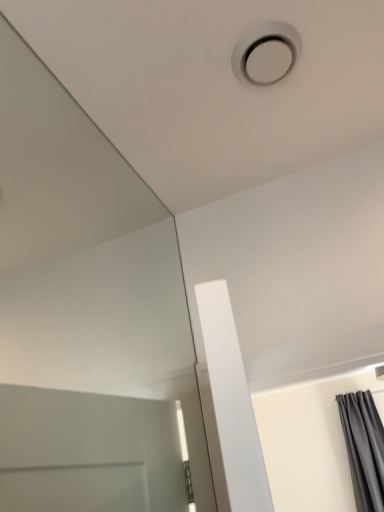
Where is `gray matte curtain at lower right`? The image size is (384, 512). gray matte curtain at lower right is located at coordinates (364, 448).

What do you see at coordinates (364, 448) in the screenshot? I see `gray matte curtain at lower right` at bounding box center [364, 448].

In order to face gray matte curtain at lower right, should I rotate leftwards or rightwards?

Turn right approximately 21.580 degrees to face it.

In order to click on gray matte curtain at lower right in this screenshot , I will do `click(364, 448)`.